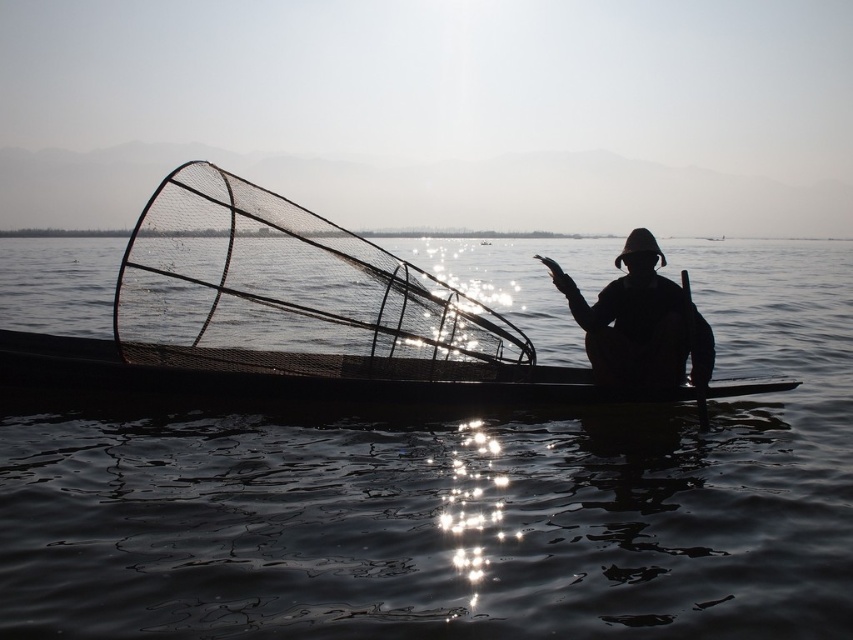
Is transparent water at center to the left of smooth wood canoe at center from the viewer's perspective?

No, transparent water at center is not to the left of smooth wood canoe at center.

Does transparent water at center have a greater width compared to smooth wood canoe at center?

Yes.

The image size is (853, 640). I want to click on transparent water at center, so click(x=466, y=502).

Does transparent water at center come in front of black wood paddle at right?

Yes, it is in front of black wood paddle at right.

Between point (289, 534) and point (703, 417), which one is positioned in front?

Point (289, 534)

This screenshot has height=640, width=853. I want to click on transparent water at center, so click(x=466, y=502).

The width and height of the screenshot is (853, 640). What are the coordinates of `transparent water at center` in the screenshot? It's located at (466, 502).

Consider the image. Who is more forward, (251, 374) or (641, 237)?

Point (251, 374)

Does smooth wood canoe at center appear over silhouette hat at center?

Actually, smooth wood canoe at center is below silhouette hat at center.

Who is more distant from viewer, (x=735, y=394) or (x=552, y=260)?

The point (x=735, y=394) is behind.

Locate an element on the screen. The image size is (853, 640). smooth wood canoe at center is located at coordinates (289, 378).